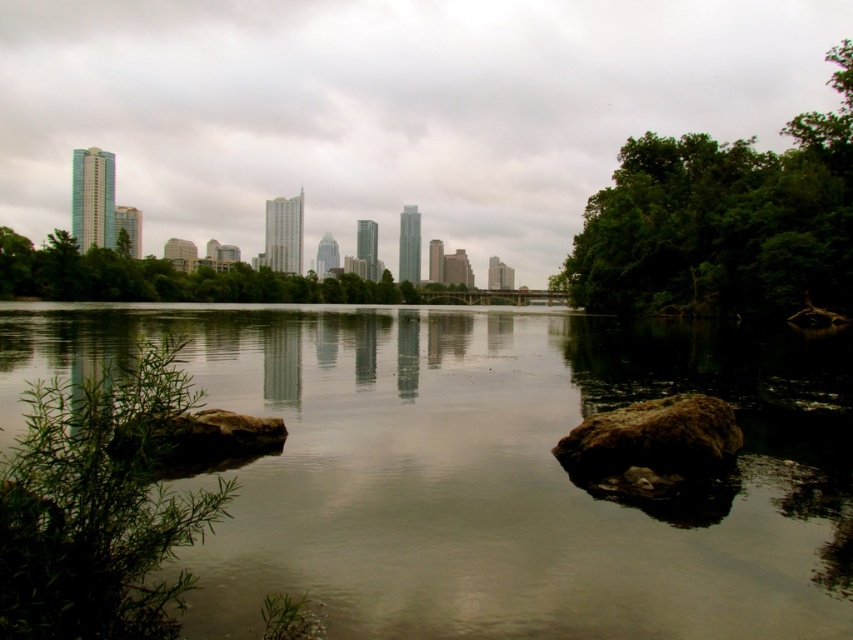
Is green leafy trees at right smaller than brown rough rock at lower left?

Incorrect, green leafy trees at right is not smaller in size than brown rough rock at lower left.

Does green leafy trees at right appear on the left side of brown rough rock at lower left?

In fact, green leafy trees at right is to the right of brown rough rock at lower left.

The image size is (853, 640). Find the location of `green leafy trees at right`. green leafy trees at right is located at coordinates (724, 221).

How distant is greenish reflective water at center from green leafy plant at left?

A distance of 29.08 meters exists between greenish reflective water at center and green leafy plant at left.

Identify the location of greenish reflective water at center. (482, 467).

Identify the location of greenish reflective water at center. (482, 467).

Who is taller, greenish reflective water at center or brown rough rock at center?

greenish reflective water at center

Does greenish reflective water at center have a greater height compared to brown rough rock at center?

Indeed, greenish reflective water at center has a greater height compared to brown rough rock at center.

This screenshot has height=640, width=853. In order to click on greenish reflective water at center in this screenshot , I will do `click(482, 467)`.